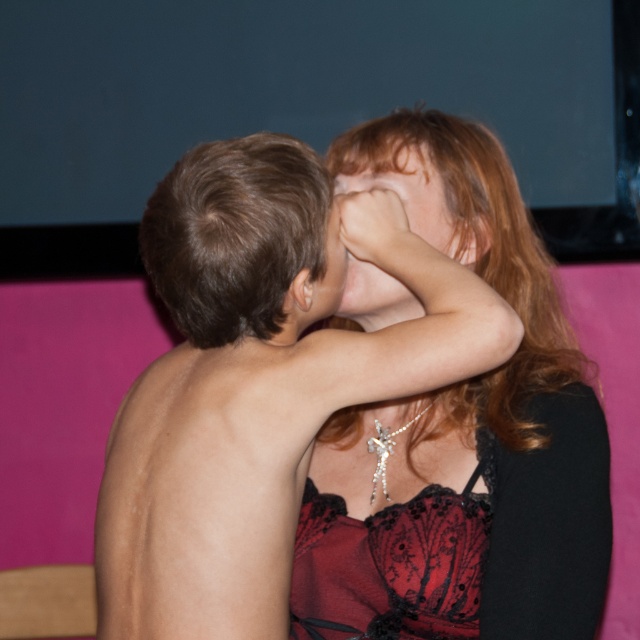
Question: Is brown hair at upper left behind velvet lace dress at center?

Choices:
 (A) no
 (B) yes

Answer: (A)

Question: Which object is farther from the camera taking this photo?

Choices:
 (A) brown hair at upper left
 (B) velvet lace dress at center
 (C) matte black lace dress at center
 (D) matte black face at center

Answer: (D)

Question: Which of the following is the farthest from the observer?

Choices:
 (A) (387, 125)
 (B) (403, 195)
 (C) (401, 305)
 (D) (291, 506)

Answer: (A)

Question: Can you confirm if brown hair at upper left is positioned to the left of smooth skin forehead at upper center?

Choices:
 (A) no
 (B) yes

Answer: (B)

Question: Is brown hair at upper left wider than velvet lace dress at center?

Choices:
 (A) yes
 (B) no

Answer: (A)

Question: Estimate the real-world distances between objects in this image. Which object is closer to the matte black face at center?

Choices:
 (A) smooth skin forehead at upper center
 (B) brown hair at upper left

Answer: (A)